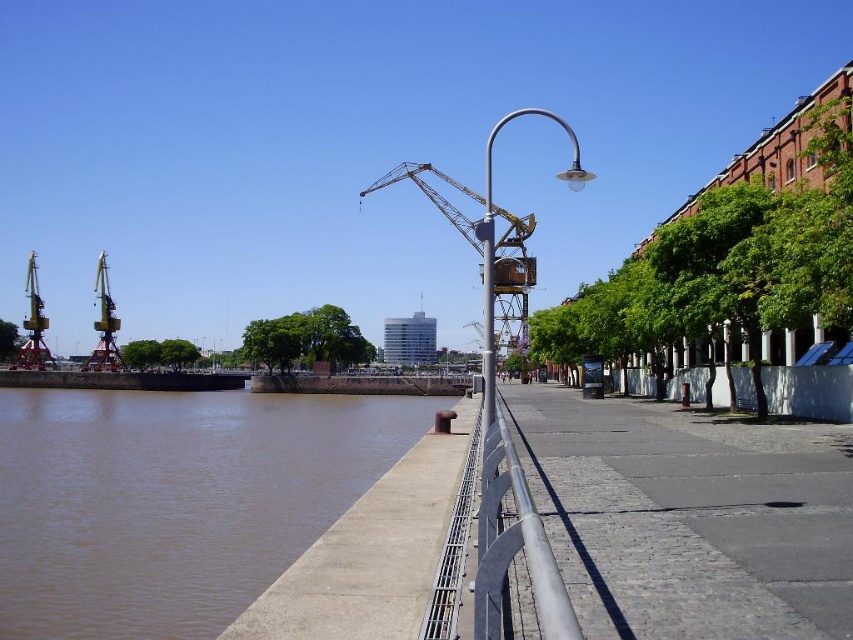
Who is shorter, yellow metallic crane at center or silver metallic pole at center?

yellow metallic crane at center is shorter.

Between yellow metallic crane at center and silver metallic pole at center, which one is positioned lower?

Positioned lower is yellow metallic crane at center.

At what (x,y) coordinates should I click in order to perform the action: click on yellow metallic crane at center. Please return your answer as a coordinate pair (x, y). Image resolution: width=853 pixels, height=640 pixels. Looking at the image, I should click on (514, 278).

Where is `yellow metallic crane at center`? The width and height of the screenshot is (853, 640). yellow metallic crane at center is located at coordinates (514, 278).

Is silver metallic rail at center positioned behind yellow metallic crane at center?

No, silver metallic rail at center is closer to the viewer.

Can you confirm if silver metallic rail at center is smaller than yellow metallic crane at center?

Yes, silver metallic rail at center is smaller than yellow metallic crane at center.

Does point (466, 467) come closer to viewer compared to point (506, 285)?

Yes, point (466, 467) is in front of point (506, 285).

Where is `silver metallic rail at center`? The height and width of the screenshot is (640, 853). silver metallic rail at center is located at coordinates (496, 548).

Between brown concrete river at lower left and cobblestone pavement at center, which one appears on the left side from the viewer's perspective?

From the viewer's perspective, brown concrete river at lower left appears more on the left side.

Which is above, brown concrete river at lower left or cobblestone pavement at center?

Positioned higher is cobblestone pavement at center.

Is point (15, 493) in front of point (795, 500)?

No, it is behind (795, 500).

Where is `brown concrete river at lower left`? The height and width of the screenshot is (640, 853). brown concrete river at lower left is located at coordinates (173, 500).